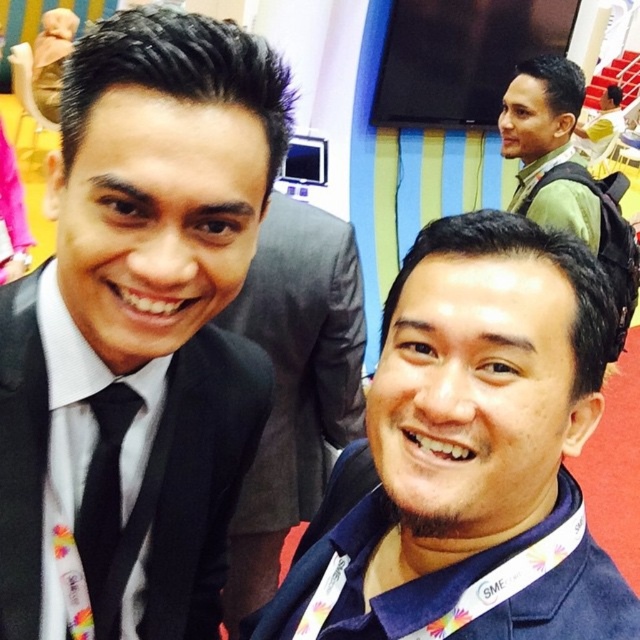
You are organizing a charity event and need to place a small donation box between the green matte jacket at upper right and the black satin tie at left. Since the box is 10 cm wide, will it fit in the space between them?

The green matte jacket at upper right is larger in size than the black satin tie at left, but the exact distance between them isn not specified. Without knowing the actual space between the two items, it is impossible to determine if the 10 cm donation box will fit.

You are standing in front of a photo of two people at an event. You notice two points marked in the image. The first point is at coordinates point (230, 51), and the second is at point (93, 417). Based on their positions, which point is nearer to you?

Point (230, 51) is closer to the viewer than point (93, 417).